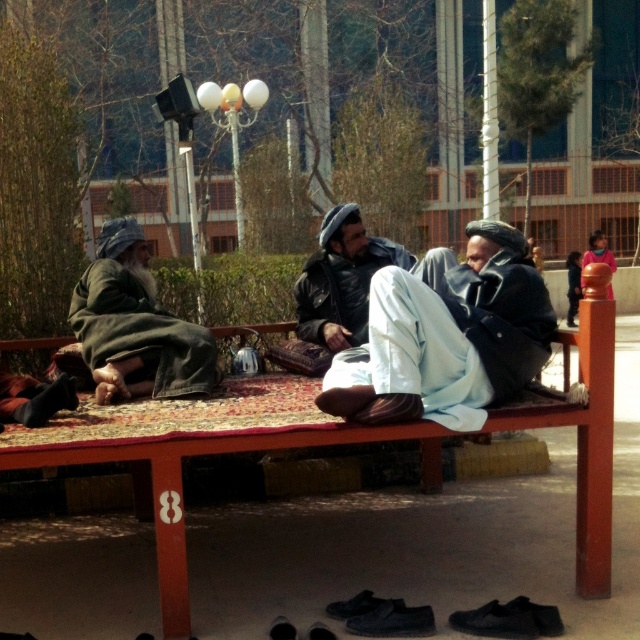
You are a photographer trying to capture a candid shot of the light blue fabric pants at center and the leather jacket at center. Since the pants are under the jacket, will you be able to see both items clearly in your photo?

The light blue fabric pants at center is positioned under the leather jacket at center, so the pants may be partially or fully obscured by the jacket, making it difficult to see both items clearly in the photo.

You are a photographer trying to capture a candid shot of the denim jacket at left and the light blue fabric pants at center. To ensure both subjects are in frame, should you adjust your camera angle to the left or to the right?

Since the light blue fabric pants at center is to the right of the denim jacket at left, you should adjust your camera angle to the right to include both the denim jacket at left and the light blue fabric pants at center in the frame.

You are a tailor who needs to determine which jacket, the denim jacket at left or the leather jacket at center, requires a larger table to lay out the fabric for tailoring. Based on the scene, can you decide which one needs a bigger table?

The denim jacket at left might be wider than the leather jacket at center, so it would require a larger table to accommodate its width during tailoring.